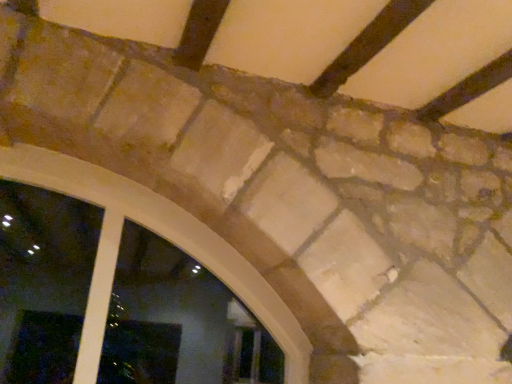
Describe the element at coordinates (161, 236) in the screenshot. This screenshot has width=512, height=384. I see `smooth stone window at upper center` at that location.

At what (x,y) coordinates should I click in order to perform the action: click on smooth stone window at upper center. Please return your answer as a coordinate pair (x, y). Looking at the image, I should click on (161, 236).

The width and height of the screenshot is (512, 384). I want to click on smooth stone window at upper center, so click(x=161, y=236).